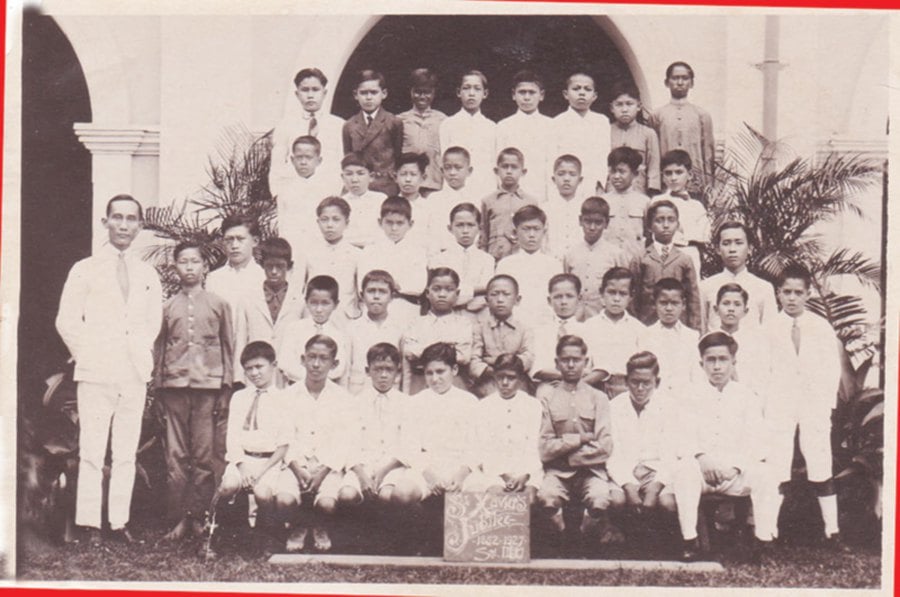
This screenshot has width=900, height=597. I want to click on plant, so click(786, 213).